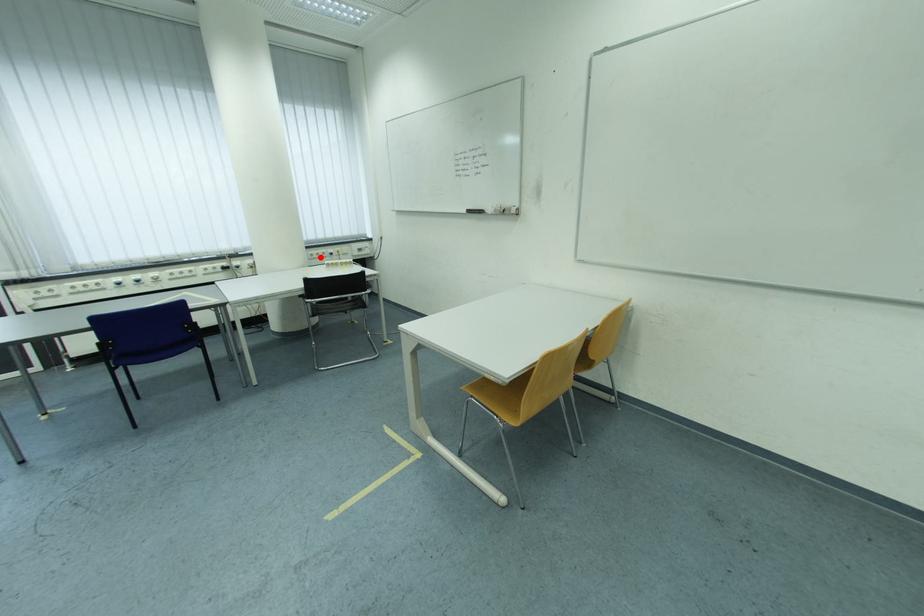
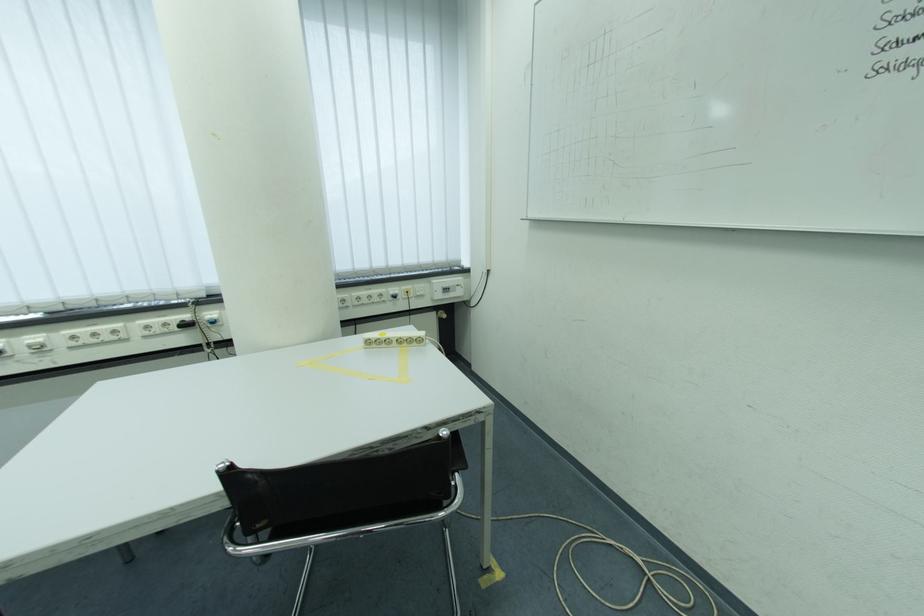
The point at the highlighted location is marked in the first image. Where is the corresponding point in the second image?

(368, 301)